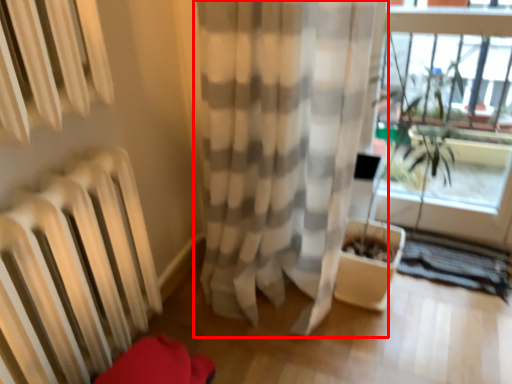
Question: Considering the relative positions of curtain (annotated by the red box) and window frame in the image provided, where is curtain (annotated by the red box) located with respect to the staircase?

Choices:
 (A) right
 (B) left

Answer: (B)